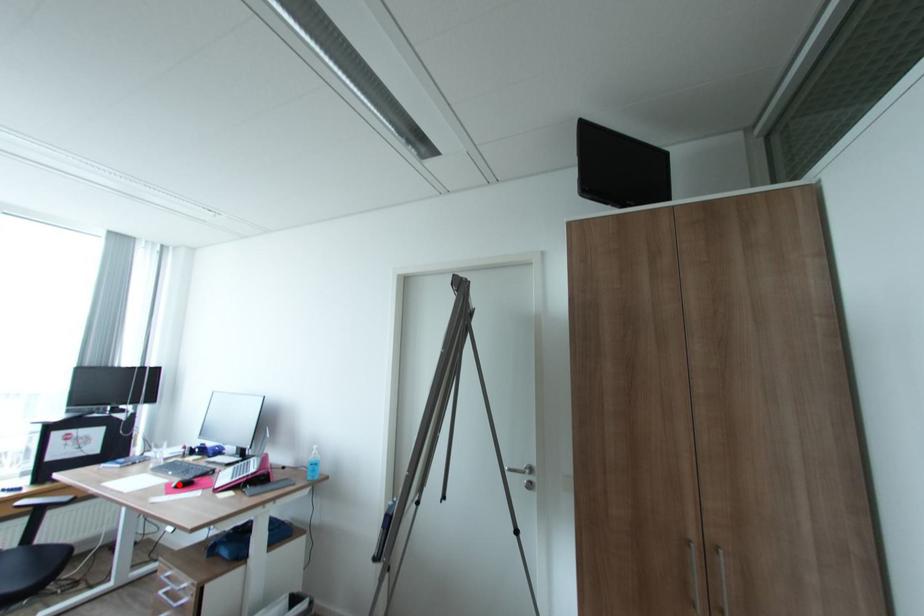
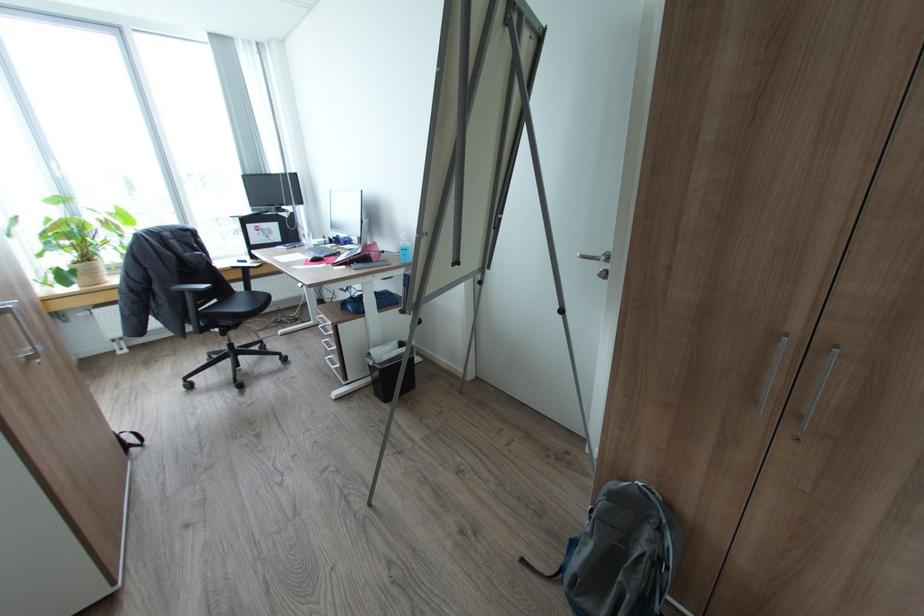
Locate, in the second image, the point that corresponds to the highlighted location in the first image.

(314, 259)